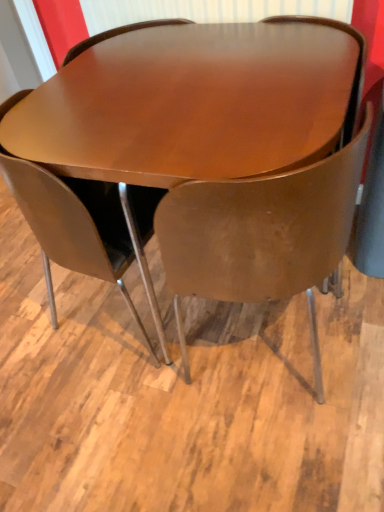
Question: Considering the positions of matte brown chair at center, which ranks as the second chair in left-to-right order, and glossy wood table at center in the image, is matte brown chair at center, which ranks as the second chair in left-to-right order, taller or shorter than glossy wood table at center?

Choices:
 (A) short
 (B) tall

Answer: (B)

Question: From the image's perspective, is matte brown chair at center, which ranks as the second chair in left-to-right order, located above or below glossy wood table at center?

Choices:
 (A) above
 (B) below

Answer: (B)

Question: Which object is positioned farthest from the glossy wood table at center?

Choices:
 (A) matte brown chair at center, the first chair in the right-to-left sequence
 (B) matte brown chair at center, positioned as the 2th chair in right-to-left order

Answer: (B)

Question: Based on their relative distances, which object is farther from the matte brown chair at center, positioned as the 2th chair in right-to-left order?

Choices:
 (A) matte brown chair at center, which ranks as the second chair in left-to-right order
 (B) glossy wood table at center

Answer: (A)